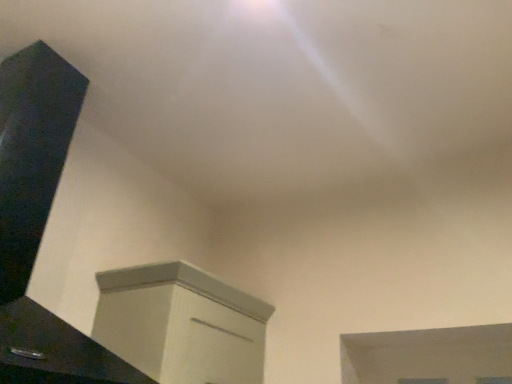
What is the approximate width of white painted wood cabinet at center?

It is 16.31 inches.

What do you see at coordinates (181, 325) in the screenshot? The height and width of the screenshot is (384, 512). I see `white painted wood cabinet at center` at bounding box center [181, 325].

The image size is (512, 384). I want to click on white painted wood cabinet at center, so click(181, 325).

Locate an element on the screen. This screenshot has height=384, width=512. white painted wood cabinet at center is located at coordinates (181, 325).